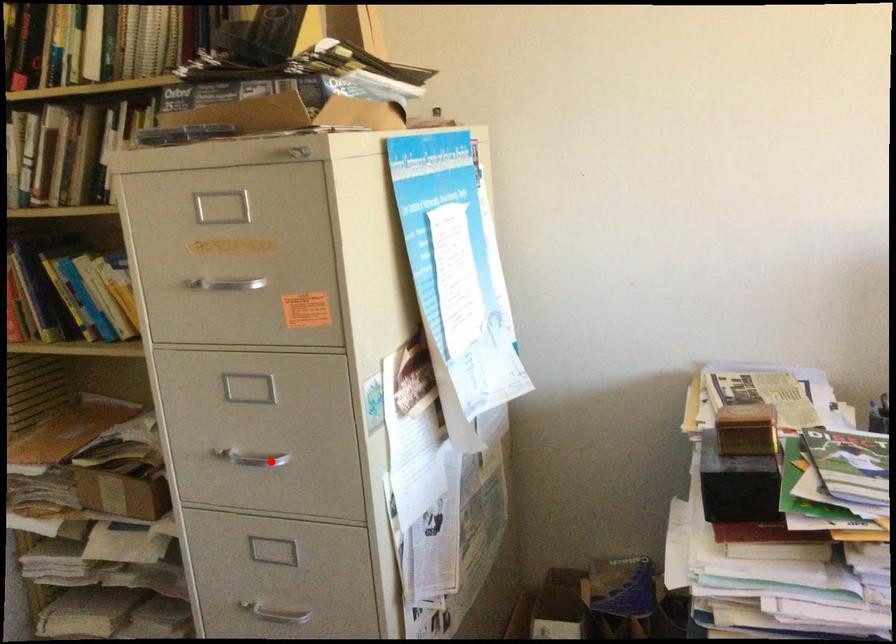
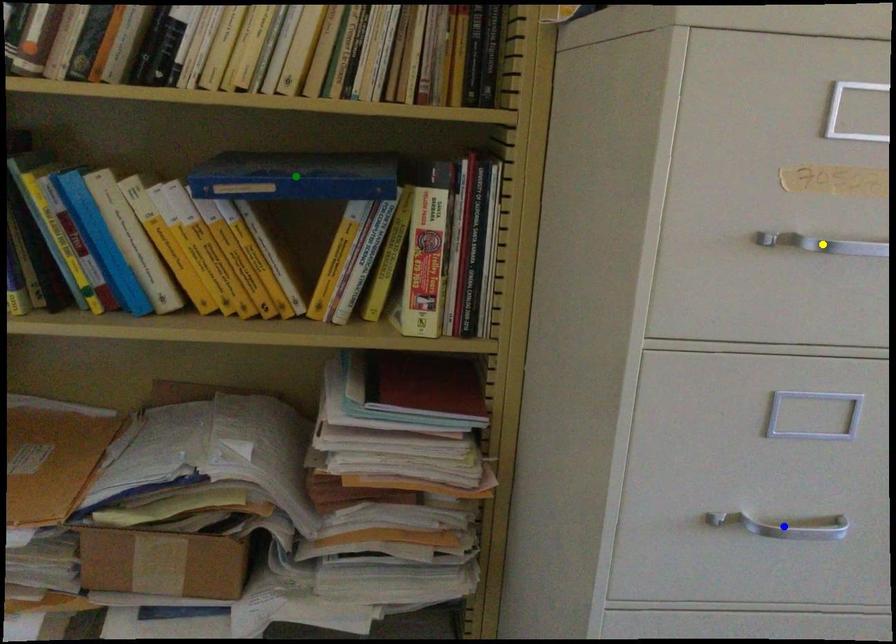
Question: I am providing you with two images of the same scene from different viewpoints. A red point is marked on the first image. You are given multiple points on the second image. Can you choose the point in image 2 that corresponds to the point in image 1?

Choices:
 (A) green point
 (B) blue point
 (C) yellow point

Answer: (B)